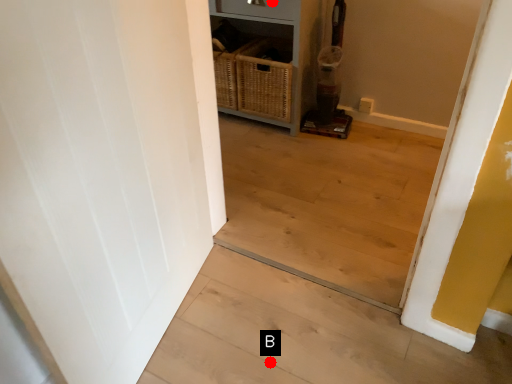
Question: Two points are circled on the image, labeled by A and B beside each circle. Which point is farther from the camera taking this photo?

Choices:
 (A) A is further
 (B) B is further

Answer: (A)